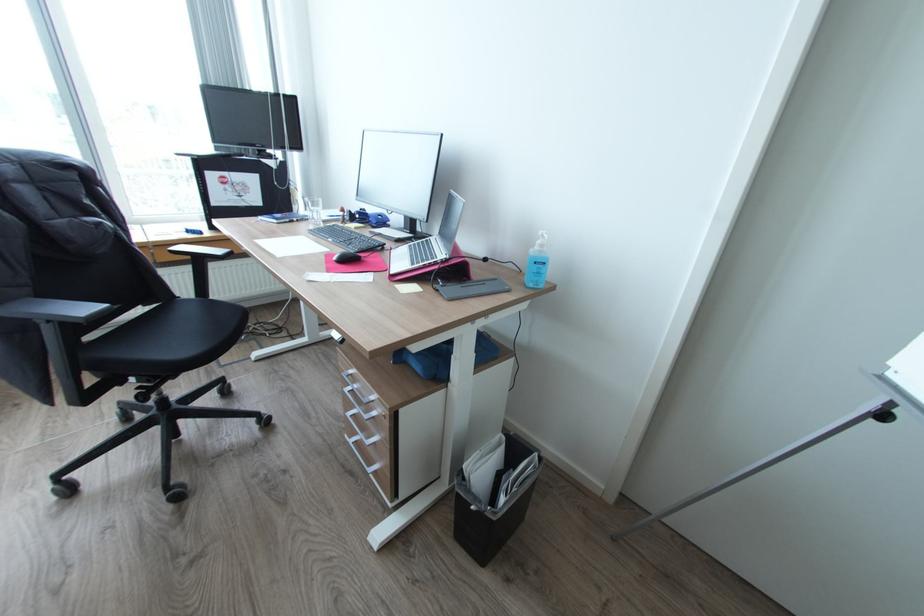
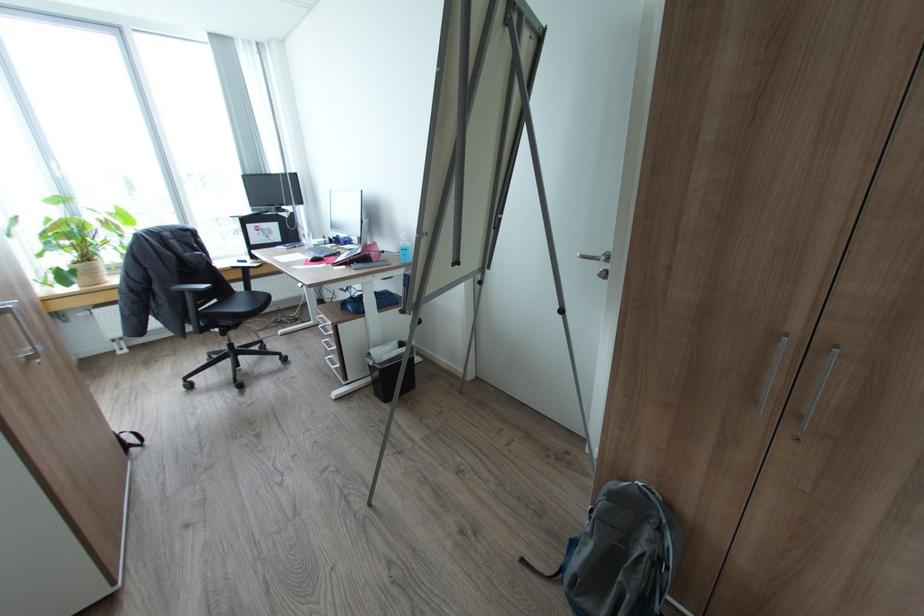
In the second image, find the point that corresponds to point (542, 272) in the first image.

(408, 254)